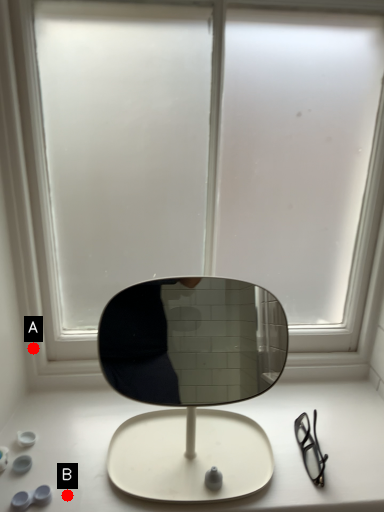
Question: Two points are circled on the image, labeled by A and B beside each circle. Among these points, which one is farthest from the camera?

Choices:
 (A) A is further
 (B) B is further

Answer: (A)